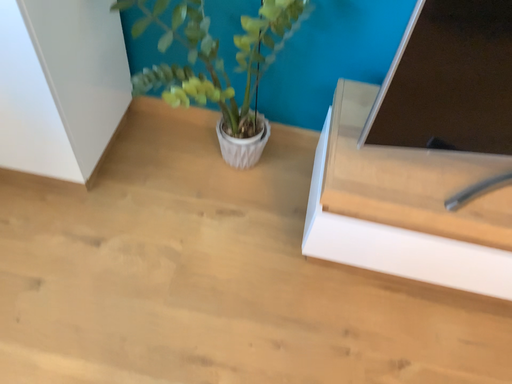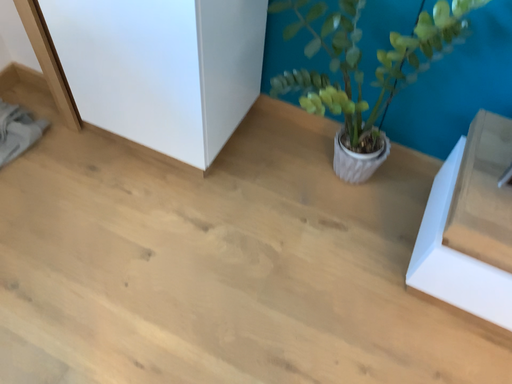
Question: Which way did the camera rotate in the video?

Choices:
 (A) rotated left
 (B) rotated right

Answer: (A)